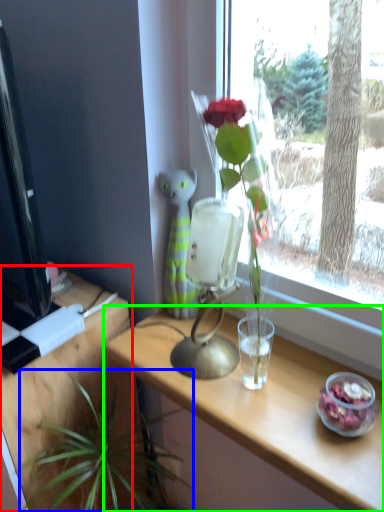
Question: Considering the real-world distances, which object is farthest from table (highlighted by a red box)? houseplant (highlighted by a blue box) or table (highlighted by a green box)?

Choices:
 (A) houseplant
 (B) table

Answer: (B)